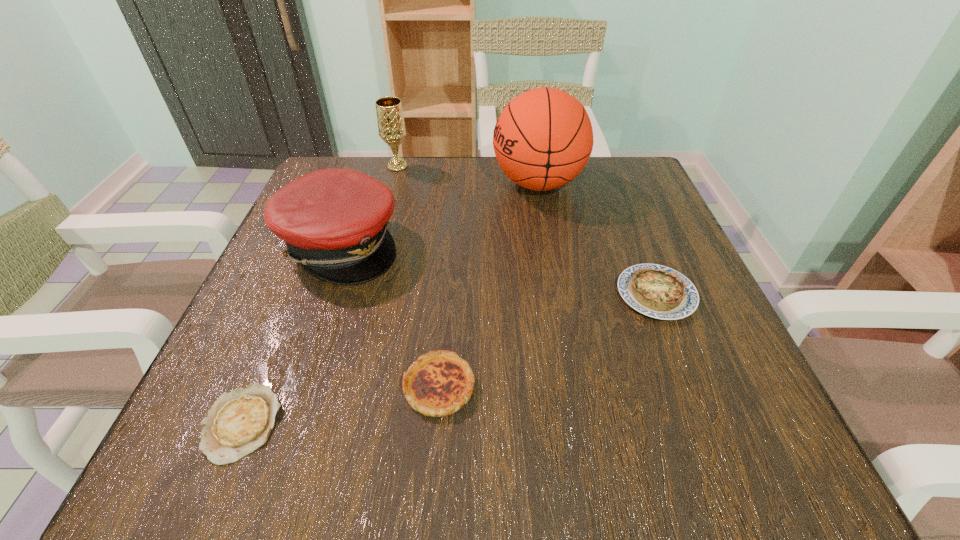
Where is `vacant space at the right edge of the desktop`? The height and width of the screenshot is (540, 960). vacant space at the right edge of the desktop is located at coordinates (606, 264).

Locate an element on the screen. vacant area at the far right corner is located at coordinates (620, 165).

This screenshot has height=540, width=960. I want to click on vacant space in between the shortest object and the basketball, so click(x=390, y=303).

Find the location of a particular element. vacant area between the tallest object and the second tallest object is located at coordinates (468, 175).

You are a GUI agent. You are given a task and a screenshot of the screen. Output one action in this format:
    pyautogui.click(x=<x>, y=<y>)
    Task: Click on the vacant region between the chalice and the shortest quiche
    This screenshot has height=540, width=960.
    Given the screenshot: What is the action you would take?
    pyautogui.click(x=319, y=295)

Locate an element on the screen. The image size is (960, 540). free area in between the tallest object and the second quiche from left to right is located at coordinates (489, 285).

The image size is (960, 540). What are the coordinates of `free space between the tallest object and the third tallest object` in the screenshot? It's located at (440, 214).

The image size is (960, 540). What are the coordinates of `free space between the farthest quiche and the chalice` in the screenshot? It's located at (527, 231).

This screenshot has height=540, width=960. I want to click on free space between the farthest quiche and the fourth object from left to right, so click(547, 340).

Locate an element on the screen. vacant region between the leftmost quiche and the fifth shortest object is located at coordinates (319, 295).